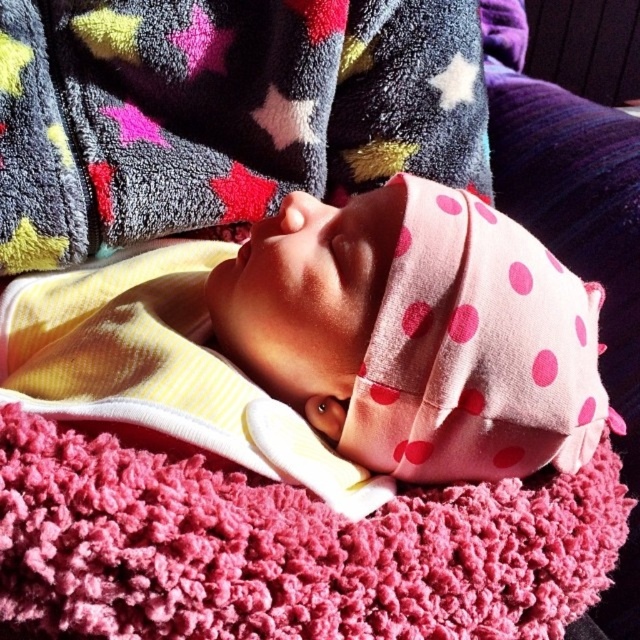
Question: Is the position of pink polka dot fabric at center less distant than that of fluffy pink blanket at lower center?

Choices:
 (A) yes
 (B) no

Answer: (B)

Question: Is the position of pink polka dot fabric at center less distant than that of fluffy pink blanket at lower center?

Choices:
 (A) no
 (B) yes

Answer: (A)

Question: Is pink polka dot fabric at center bigger than fluffy pink blanket at lower center?

Choices:
 (A) no
 (B) yes

Answer: (B)

Question: Which point is closer to the camera?

Choices:
 (A) (1, 600)
 (B) (544, 340)

Answer: (A)